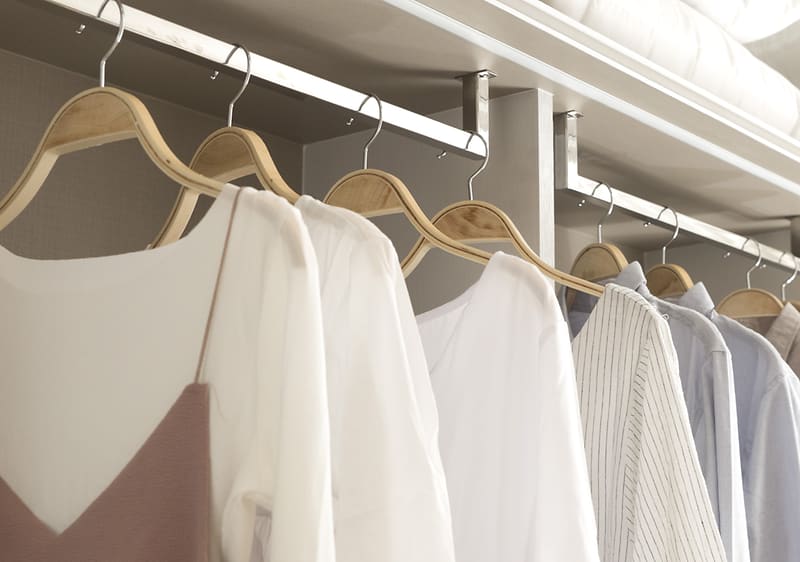
In order to click on wooden clothes hanger in this screenshot , I will do `click(110, 117)`, `click(222, 149)`, `click(362, 196)`, `click(484, 225)`, `click(602, 262)`, `click(666, 280)`, `click(741, 300)`, `click(796, 303)`.